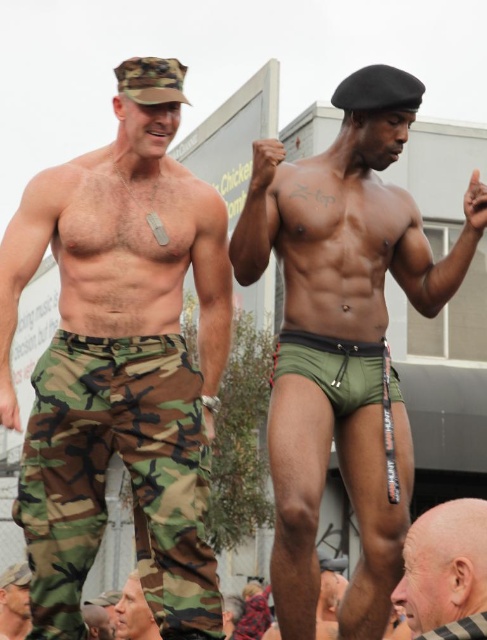
Who is more forward, (96, 412) or (295, 532)?

Positioned in front is point (295, 532).

Find the location of a particular element. The height and width of the screenshot is (640, 487). camo pants at left is located at coordinates (120, 362).

This screenshot has width=487, height=640. What do you see at coordinates (120, 362) in the screenshot? I see `camo pants at left` at bounding box center [120, 362].

You are a GUI agent. You are given a task and a screenshot of the screen. Output one action in this format:
    pyautogui.click(x=<x>, y=<y>)
    Task: Click on the camo pants at left
    Image resolution: width=487 pixels, height=640 pixels.
    Given the screenshot: What is the action you would take?
    pyautogui.click(x=120, y=362)

Can you confirm if green matte shorts at center is positioned below camouflage pants at lower left?

No.

Can you confirm if green matte shorts at center is positioned above camouflage pants at lower left?

Yes.

Who is more distant from viewer, (357, 371) or (146, 630)?

The point (146, 630) is behind.

The width and height of the screenshot is (487, 640). I want to click on green matte shorts at center, so click(x=343, y=337).

Which is above, bald head at lower right or camouflage pants at center?

bald head at lower right is higher up.

Is the position of bald head at lower right more distant than that of camouflage pants at center?

No.

Measure the distance between point (427, 621) and camera.

They are 41.77 meters apart.

Where is `bald head at lower right`? bald head at lower right is located at coordinates (446, 572).